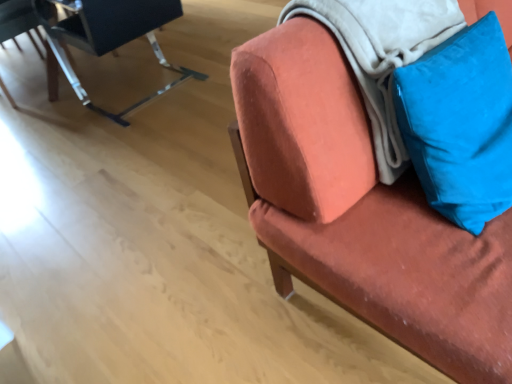
Image resolution: width=512 pixels, height=384 pixels. In order to click on vacant space in metallic black chair at upper left, which appears as the second chair when viewed from the right (from a real-world perspective) in this screenshot , I will do `click(147, 94)`.